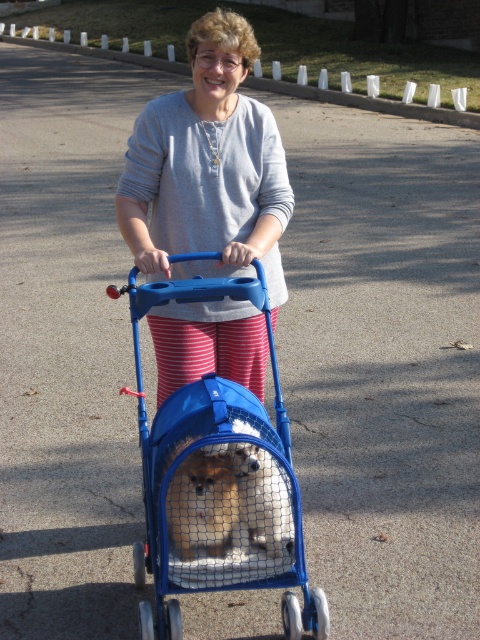
Question: Among these objects, which one is nearest to the camera?

Choices:
 (A) blue plastic pet carrier at center
 (B) gray cotton sweater at center

Answer: (A)

Question: Which object is farther from the camera taking this photo?

Choices:
 (A) blue plastic pet carrier at center
 (B) gray cotton sweater at center

Answer: (B)

Question: Which point appears farthest from the camera in this image?

Choices:
 (A) click(x=204, y=438)
 (B) click(x=139, y=208)

Answer: (B)

Question: Is the position of gray cotton sweater at center more distant than that of blue plastic pet carrier at center?

Choices:
 (A) yes
 (B) no

Answer: (A)

Question: Does gray cotton sweater at center appear under blue plastic pet carrier at center?

Choices:
 (A) yes
 (B) no

Answer: (B)

Question: Can you confirm if gray cotton sweater at center is positioned above blue plastic pet carrier at center?

Choices:
 (A) yes
 (B) no

Answer: (A)